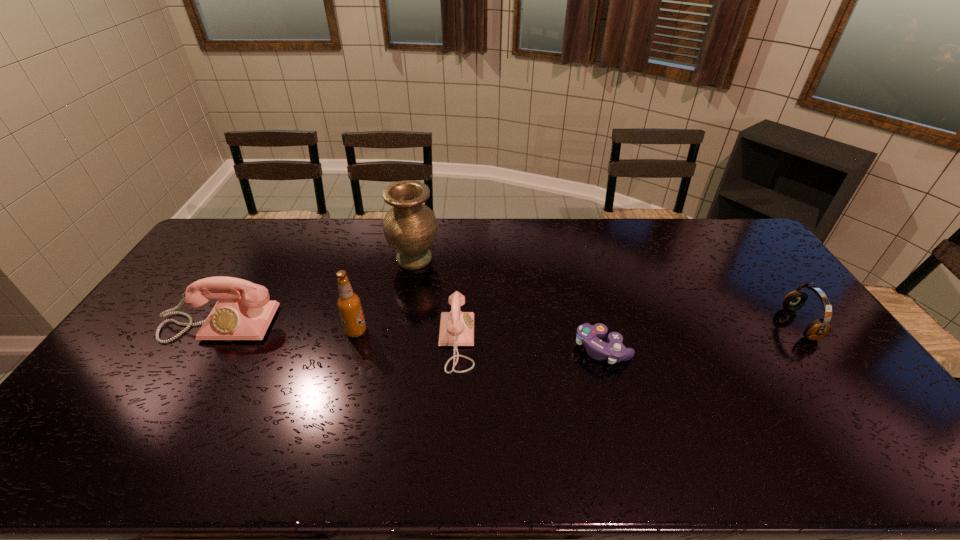
You are a GUI agent. You are given a task and a screenshot of the screen. Output one action in this format:
    pyautogui.click(x=<x>, y=<y>)
    Task: Click on the control
    This screenshot has height=540, width=960.
    Given the screenshot: What is the action you would take?
    pyautogui.click(x=588, y=335)

Identify the location of free point located on the dial of the left telephone. Image resolution: width=960 pixels, height=540 pixels. (158, 424).

Find the location of a particular element. Image resolution: width=960 pixels, height=540 pixels. vacant space situated 0.310m on the dial of the right telephone is located at coordinates (581, 342).

Identify the location of vacant space situated on the left of the third object from left to right. The height and width of the screenshot is (540, 960). (353, 259).

Identify the location of vacant space located 0.180m on the front label of the beer bottle. (427, 331).

At what (x,y) coordinates should I click in order to perform the action: click on vacant area located on the ear cups of the headset. Please return your answer as a coordinate pair (x, y). Image resolution: width=960 pixels, height=540 pixels. Looking at the image, I should click on (733, 324).

Where is `vacant space situated on the ear cups of the headset`? The image size is (960, 540). vacant space situated on the ear cups of the headset is located at coordinates (724, 324).

At what (x,y) coordinates should I click in order to perform the action: click on vacant space located on the ear cups of the headset. Please return your answer as a coordinate pair (x, y). This screenshot has width=960, height=540. Looking at the image, I should click on (701, 324).

Image resolution: width=960 pixels, height=540 pixels. Find the location of `free location located on the back of the control`. free location located on the back of the control is located at coordinates (591, 305).

I want to click on object situated at the far edge, so click(x=410, y=227).